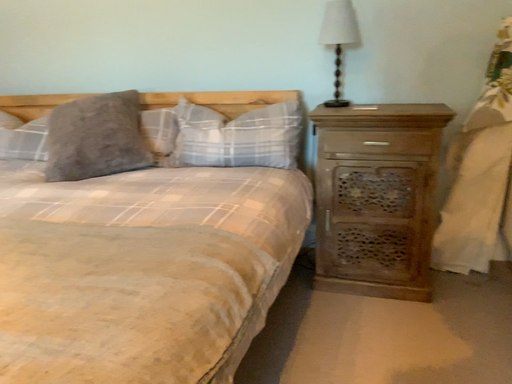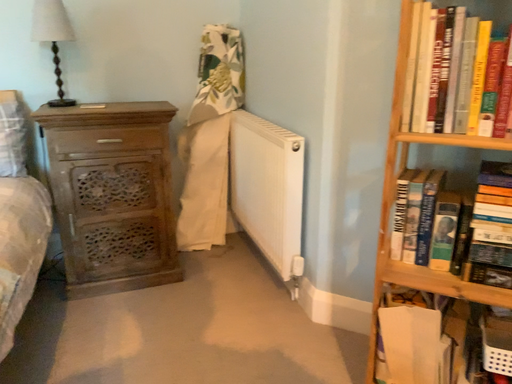
Question: How did the camera likely rotate when shooting the video?

Choices:
 (A) rotated right
 (B) rotated left

Answer: (A)